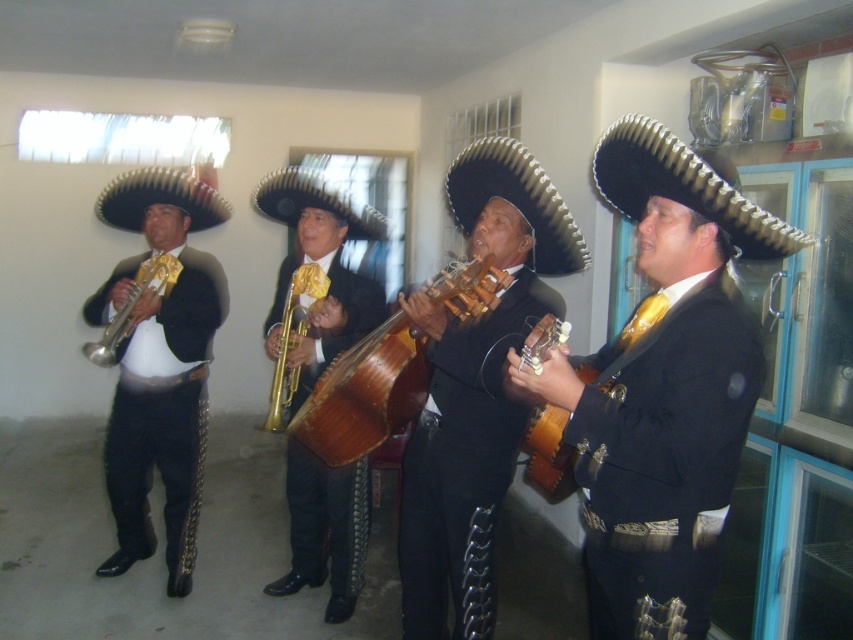
Question: Based on their relative distances, which object is farther from the shiny black mariachi hat at center?

Choices:
 (A) shiny brass trumpet at left
 (B) wooden guitar at center
 (C) matte black trumpet at left
 (D) shiny metallic sombrero at center

Answer: (A)

Question: Based on their relative distances, which object is farther from the shiny black guitar at center?

Choices:
 (A) shiny black mariachi hat at center
 (B) shiny brass trumpet at left

Answer: (B)

Question: In this image, where is shiny metallic sombrero at center located relative to gold shiny trumpet at center?

Choices:
 (A) left
 (B) right

Answer: (B)

Question: Is shiny gold trumpet at center to the left of black straw sombrero at right from the viewer's perspective?

Choices:
 (A) no
 (B) yes

Answer: (B)

Question: Is shiny black mariachi hat at center above shiny metallic sombrero at left?

Choices:
 (A) yes
 (B) no

Answer: (B)

Question: Which object is farther from the camera taking this photo?

Choices:
 (A) matte black trumpet at left
 (B) shiny gold trumpet at center
 (C) black felt sombrero at center
 (D) wooden string instrument at center

Answer: (A)